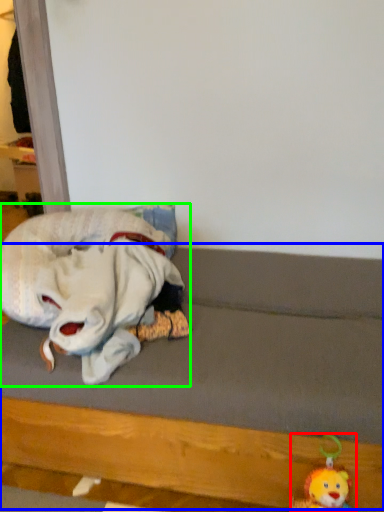
Question: Which object is positioned farthest from toy (highlighted by a red box)? Select from bed frame (highlighted by a blue box) and toy (highlighted by a green box).

Choices:
 (A) bed frame
 (B) toy

Answer: (B)